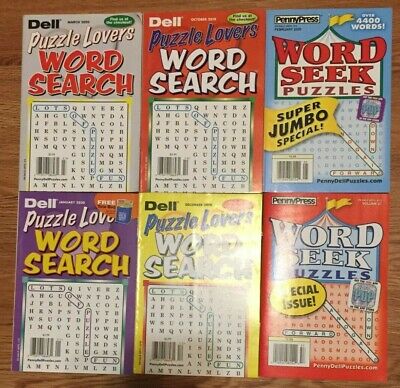
Identify the location of yellow book. (149, 243).